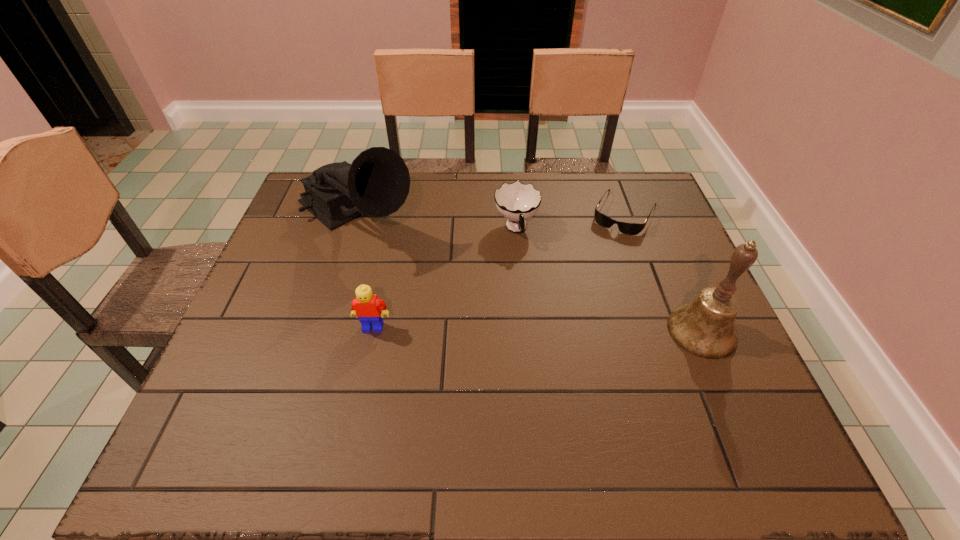
Locate which object is the fourth closest to the bell. Please provide its 2D coordinates. Your answer should be formatted as a tuple, i.e. [(x, y)], where the tuple contains the x and y coordinates of a point satisfying the conditions above.

[(367, 307)]

Image resolution: width=960 pixels, height=540 pixels. I want to click on object identified as the fourth closest to the phonograph_record, so click(705, 327).

Locate an element on the screen. The width and height of the screenshot is (960, 540). free region that satisfies the following two spatial constraints: 1. on the front side of the phonograph_record; 2. on the left side of the bell is located at coordinates (321, 331).

You are a GUI agent. You are given a task and a screenshot of the screen. Output one action in this format:
    pyautogui.click(x=<x>, y=<y>)
    Task: Click on the free space that satisfies the following two spatial constraints: 1. on the front side of the phonograph_record; 2. on the left side of the third object from right to left
    The width and height of the screenshot is (960, 540).
    Given the screenshot: What is the action you would take?
    pyautogui.click(x=352, y=229)

The height and width of the screenshot is (540, 960). Identify the location of free space that satisfies the following two spatial constraints: 1. on the front side of the phonograph_record; 2. on the right side of the bell. (321, 331).

Locate an element on the screen. The image size is (960, 540). vacant region that satisfies the following two spatial constraints: 1. on the front-facing side of the Lego; 2. on the right side of the bell is located at coordinates (372, 331).